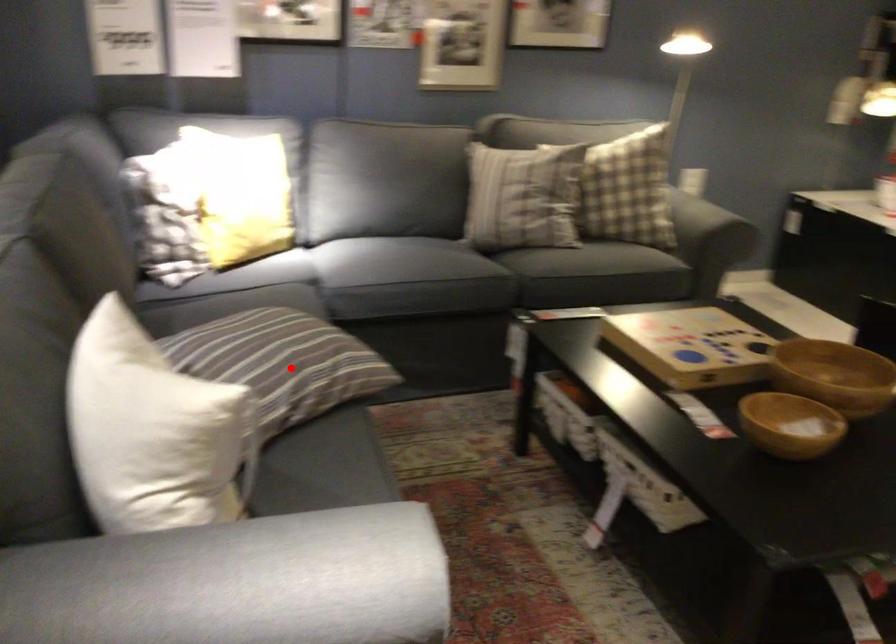
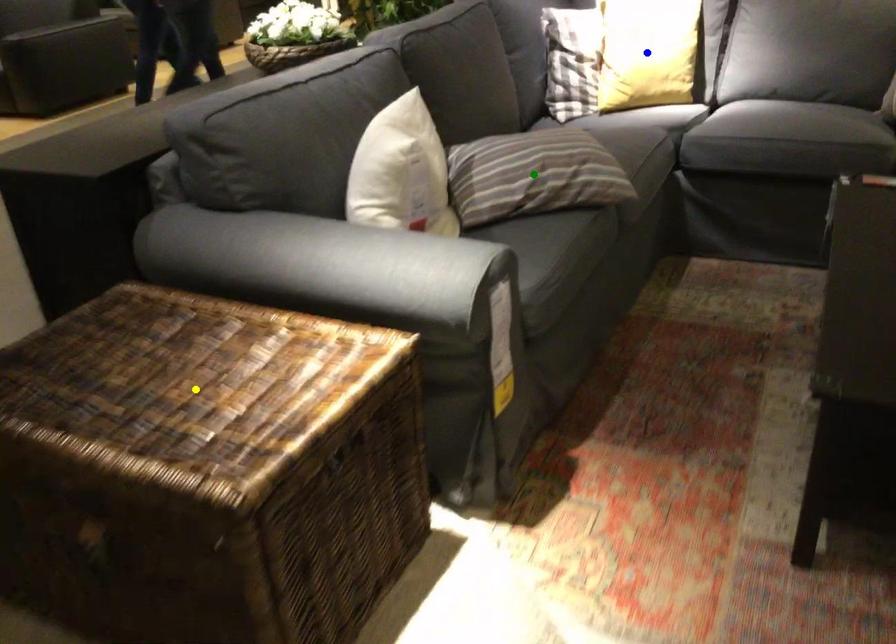
Question: I am providing you with two images of the same scene from different viewpoints. A red point is marked on the first image. You are given multiple points on the second image. Which mark in image 2 goes with the point in image 1?

Choices:
 (A) green point
 (B) yellow point
 (C) blue point

Answer: (A)